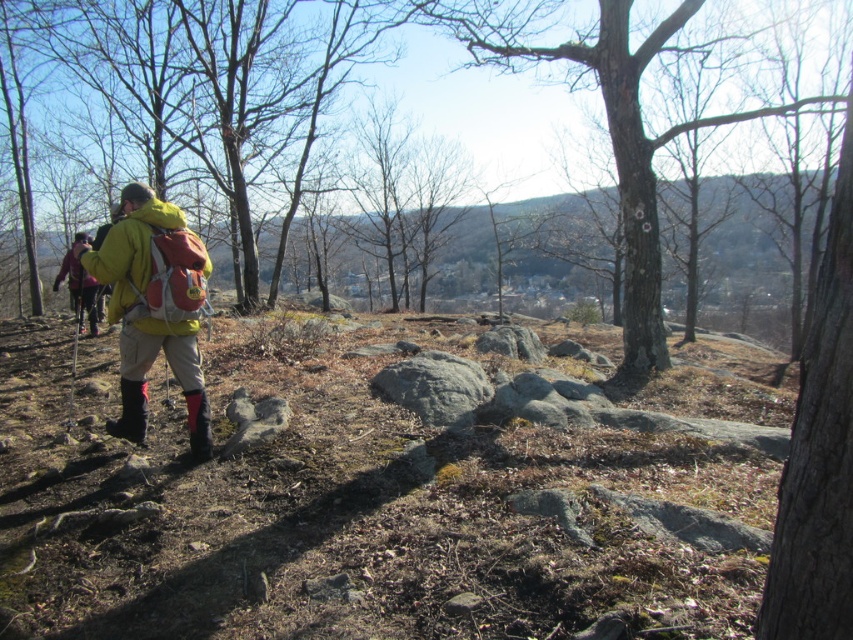
The hiker is standing on a rocky hillside with a red backpack and bright yellow jacket. There is a specific point at coordinates [154,307]. What object is located at that point?

The point at coordinates [154,307] is on the matte yellow jacket at center.